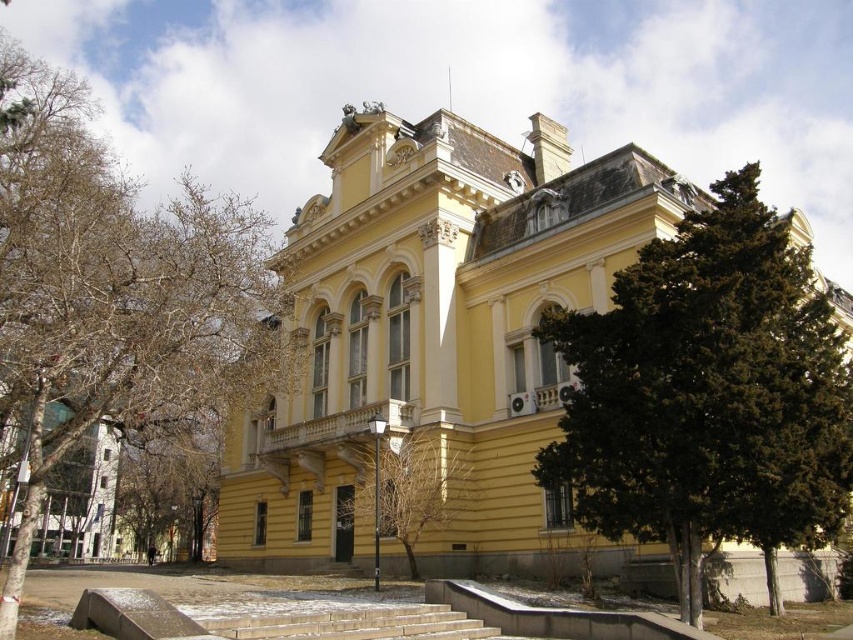
Question: Can you confirm if yellow painted wood palace at center is positioned below green leafy tree at center?

Choices:
 (A) no
 (B) yes

Answer: (A)

Question: Does bare branches at left appear over green leafy tree at center?

Choices:
 (A) yes
 (B) no

Answer: (A)

Question: Which object is closer to the camera taking this photo?

Choices:
 (A) dark green coniferous tree at right
 (B) yellow painted wood palace at center
 (C) bare branches at left

Answer: (C)

Question: Which point is closer to the camera?

Choices:
 (A) dark green coniferous tree at right
 (B) yellow painted wood palace at center

Answer: (A)

Question: Is yellow painted wood palace at center bigger than dark green coniferous tree at right?

Choices:
 (A) yes
 (B) no

Answer: (A)

Question: Which point is closer to the camera?

Choices:
 (A) dark green coniferous tree at right
 (B) bare branches at left
 (C) green leafy tree at center
 (D) yellow painted wood palace at center

Answer: (B)